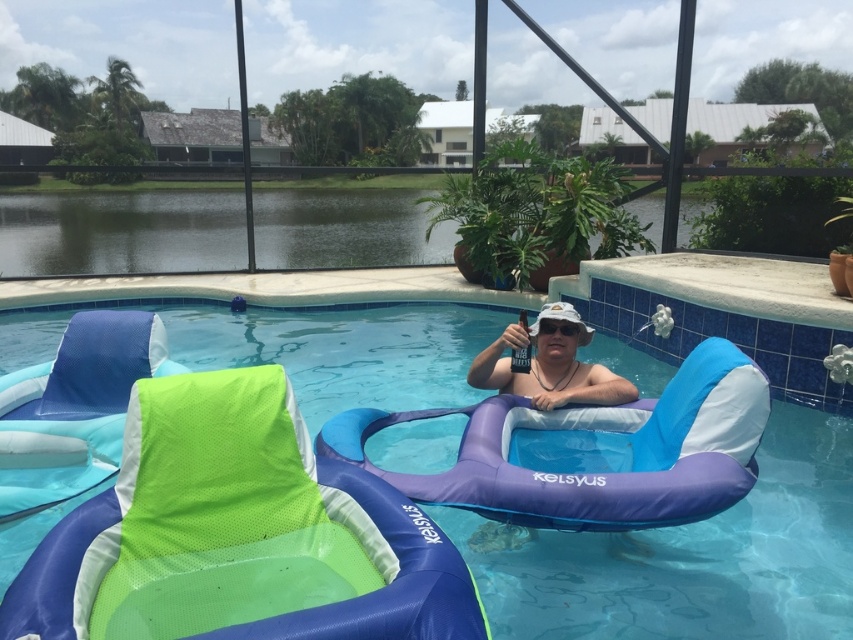
Can you confirm if blue inflatable float at center is positioned to the right of white matte goggles at center?

Incorrect, blue inflatable float at center is not on the right side of white matte goggles at center.

Is point (15, 291) positioned before point (577, 328)?

That is False.

Which is in front, point (247, 353) or point (538, 324)?

Point (538, 324)

This screenshot has height=640, width=853. Find the location of `blue inflatable float at center`. blue inflatable float at center is located at coordinates (695, 560).